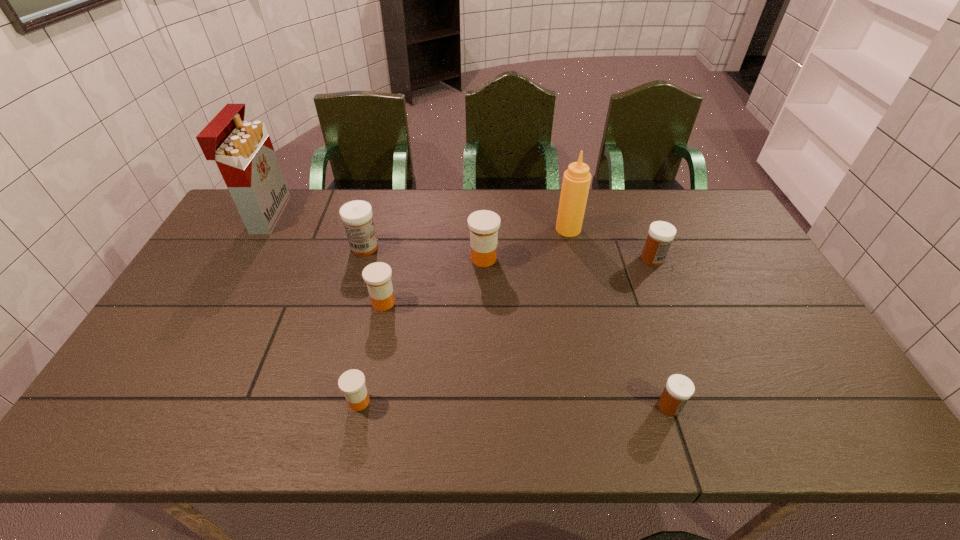
You are a GUI agent. You are given a task and a screenshot of the screen. Output one action in this format:
    pyautogui.click(x=<x>, y=<y>)
    Task: Click on the free location at the near right corner
    The height and width of the screenshot is (540, 960).
    Given the screenshot: What is the action you would take?
    [845, 435]

At what (x,y) coordinates should I click in order to perform the action: click on free space between the rightmost white medicine and the nearest orange medicine. Please return your answer as a coordinate pair (x, y). This screenshot has height=540, width=960. Looking at the image, I should click on (506, 330).

The width and height of the screenshot is (960, 540). What are the coordinates of `free space between the seventh object from left to right and the leftmost object` in the screenshot? It's located at (468, 310).

Identify the location of free space between the smallest orange medicine and the third nearest medicine. Image resolution: width=960 pixels, height=540 pixels. (372, 352).

You are a GUI agent. You are given a task and a screenshot of the screen. Output one action in this format:
    pyautogui.click(x=<x>, y=<y>)
    Task: Click on the vacant area between the rightmost white medicine and the leftmost white medicine
    
    Given the screenshot: What is the action you would take?
    pyautogui.click(x=509, y=253)

The width and height of the screenshot is (960, 540). What are the coordinates of `unoccupied position between the rightmost white medicine and the third nearest object` in the screenshot? It's located at (518, 281).

Where is `unoccupied position between the rightmost object and the seventh shortest object`? The height and width of the screenshot is (540, 960). unoccupied position between the rightmost object and the seventh shortest object is located at coordinates (611, 244).

Locate an element on the screen. free space between the second biggest white medicine and the fourth medicine from left to right is located at coordinates (568, 259).

Locate an element on the screen. The height and width of the screenshot is (540, 960). free space that is in between the rightmost orange medicine and the seventh object from right to left is located at coordinates (424, 253).

The height and width of the screenshot is (540, 960). I want to click on empty location between the seventh object from right to left and the smallest white medicine, so click(x=516, y=327).